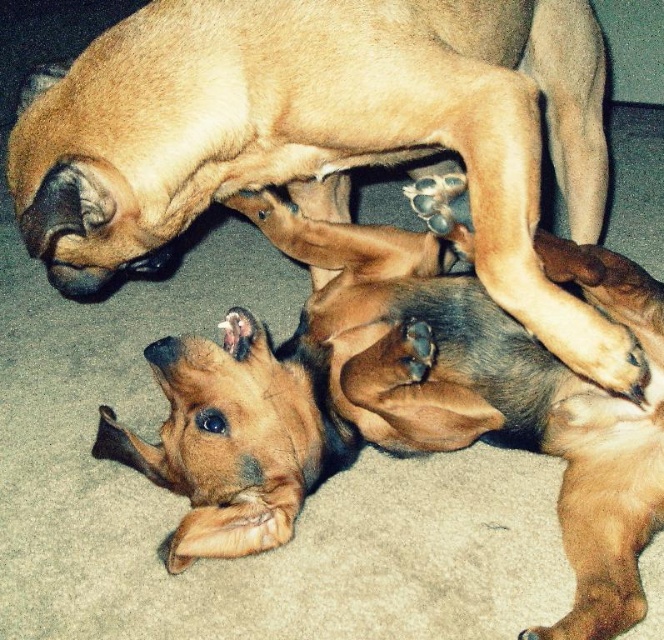
Can you confirm if brown matte dog at center is thinner than brown furry dog at lower center?

Incorrect, brown matte dog at center's width is not less than brown furry dog at lower center's.

Who is more forward, (305, 163) or (345, 442)?

Point (305, 163)

Where is `brown matte dog at center`? The height and width of the screenshot is (640, 664). brown matte dog at center is located at coordinates (325, 132).